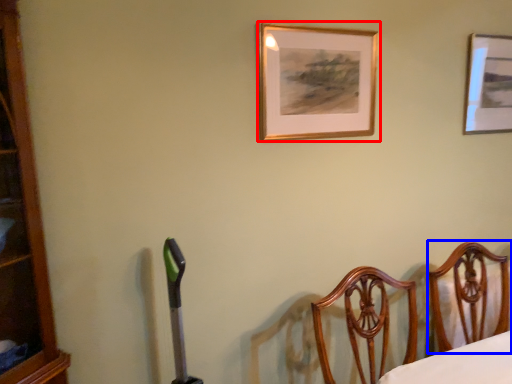
Question: Which object appears closest to the camera in this image, picture frame (highlighted by a red box) or furniture (highlighted by a blue box)?

Choices:
 (A) picture frame
 (B) furniture

Answer: (B)